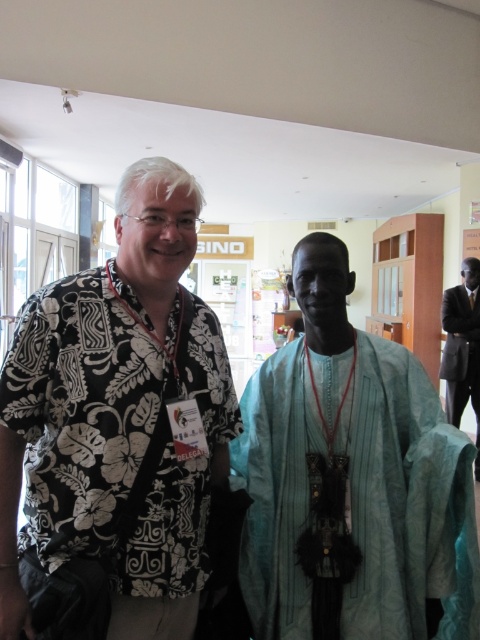
Is point (113, 548) positioned behind point (271, 387)?

No, (113, 548) is closer to viewer.

Does black floral shirt at left appear on the left side of light blue fabric robe at center?

Yes, black floral shirt at left is to the left of light blue fabric robe at center.

Who is more distant from viewer, (148, 355) or (456, 435)?

Point (456, 435)

The width and height of the screenshot is (480, 640). I want to click on black floral shirt at left, so click(120, 435).

Does light blue fabric robe at center appear under black suit at right?

Yes.

Does light blue fabric robe at center appear over black suit at right?

Incorrect, light blue fabric robe at center is not positioned above black suit at right.

Is point (381, 355) more distant than point (469, 342)?

No, it is in front of (469, 342).

You are a GUI agent. You are given a task and a screenshot of the screen. Output one action in this format:
    pyautogui.click(x=<x>, y=<y>)
    Task: Click on the light blue fabric robe at center
    This screenshot has width=480, height=640.
    Given the screenshot: What is the action you would take?
    pyautogui.click(x=406, y=502)

Does black floral shirt at left appear over black suit at right?

Correct, black floral shirt at left is located above black suit at right.

Who is positioned more to the right, black floral shirt at left or black suit at right?

Positioned to the right is black suit at right.

Is point (41, 435) in front of point (450, 394)?

Yes, it is in front of point (450, 394).

Where is `black floral shirt at left`? This screenshot has height=640, width=480. black floral shirt at left is located at coordinates (120, 435).